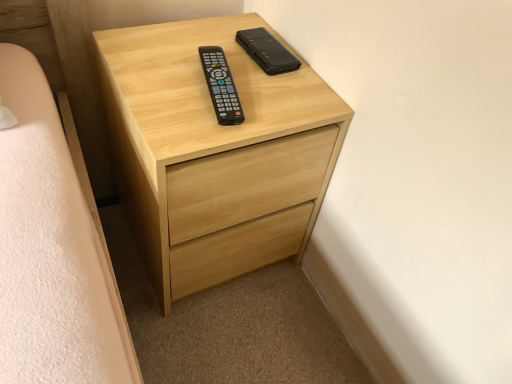
This screenshot has height=384, width=512. Identify the location of vacant space to the right of black plastic remote at center, the second control viewed from the back. (285, 105).